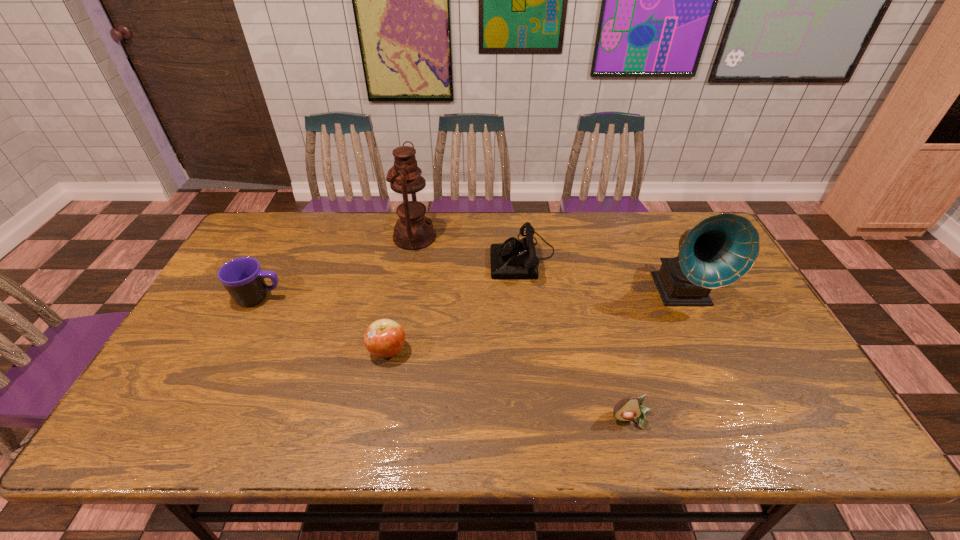
This screenshot has width=960, height=540. In order to click on vacant area situated 0.310m on the front face of the third object from right to left in this screenshot , I will do `click(395, 256)`.

Locate an element on the screen. free space located 0.400m on the front face of the third object from right to left is located at coordinates (367, 256).

Image resolution: width=960 pixels, height=540 pixels. I want to click on vacant space positioned with the handle on the side of the leftmost object, so click(x=309, y=298).

What are the coordinates of `vacant space situated on the left of the second nearest object` in the screenshot? It's located at (296, 350).

Find the location of a particular element. oil lamp that is at the far edge is located at coordinates (413, 231).

This screenshot has width=960, height=540. I want to click on telephone that is positioned at the far edge, so (x=514, y=259).

The image size is (960, 540). In order to click on object that is at the near edge in this screenshot , I will do `click(628, 409)`.

The width and height of the screenshot is (960, 540). In order to click on object positioned at the left edge in this screenshot , I will do `click(242, 277)`.

Identify the location of object positioned at the right edge. Image resolution: width=960 pixels, height=540 pixels. (719, 250).

Locate an element on the screen. The width and height of the screenshot is (960, 540). free spot at the far edge of the desktop is located at coordinates (474, 232).